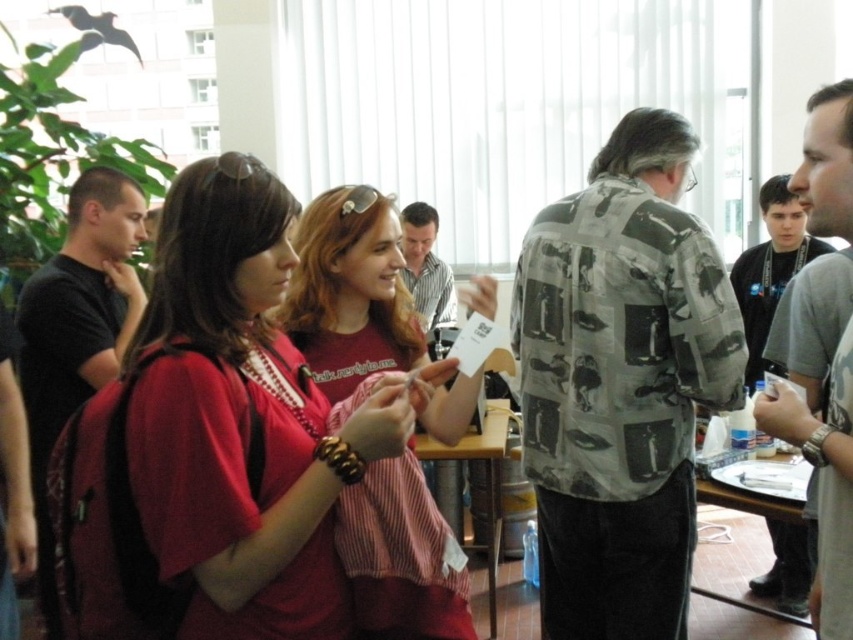
In the scene shown: Is printed camouflage shirt at center thinner than light brown striped shirt at center?

In fact, printed camouflage shirt at center might be wider than light brown striped shirt at center.

Does printed camouflage shirt at center have a greater height compared to light brown striped shirt at center?

Correct, printed camouflage shirt at center is much taller as light brown striped shirt at center.

Between point (614, 275) and point (421, 269), which one is positioned in front?

Positioned in front is point (614, 275).

Identify the location of printed camouflage shirt at center. (621, 381).

Does matte red shirt at center have a smaller size compared to gray printed shirt at center?

Correct, matte red shirt at center occupies less space than gray printed shirt at center.

Is point (144, 524) farther from viewer compared to point (780, 410)?

No, (144, 524) is in front of (780, 410).

Between point (291, 470) and point (836, 426), which one is positioned in front?

Point (291, 470)

Identify the location of matte red shirt at center. (239, 419).

Which is above, matte red shirt at center or black matte shirt at left?

black matte shirt at left is higher up.

Is matte red shirt at center below black matte shirt at left?

Indeed, matte red shirt at center is positioned under black matte shirt at left.

Consider the image. Measure the distance between matte red shirt at center and camera.

The distance of matte red shirt at center from camera is 3.70 feet.

Where is `matte red shirt at center`? The image size is (853, 640). matte red shirt at center is located at coordinates (239, 419).